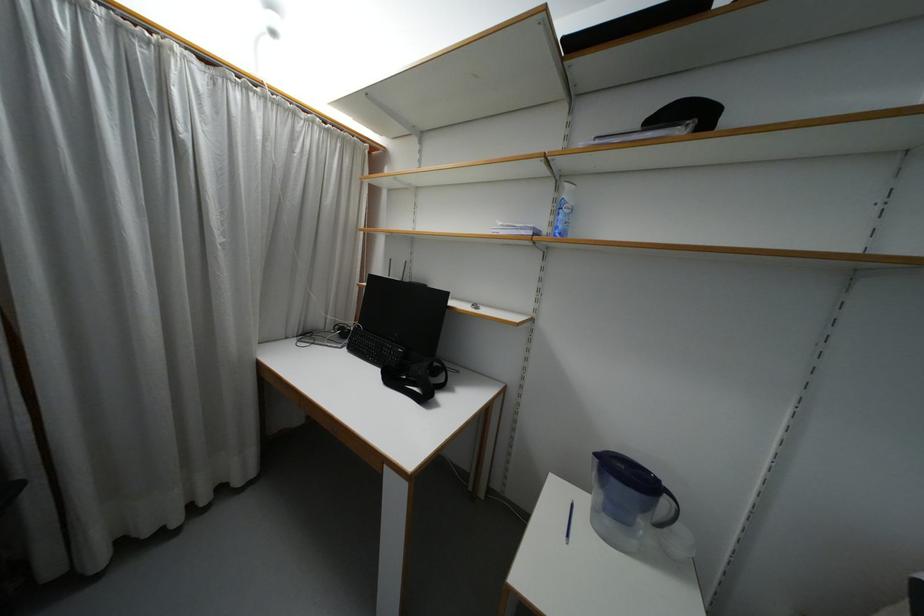
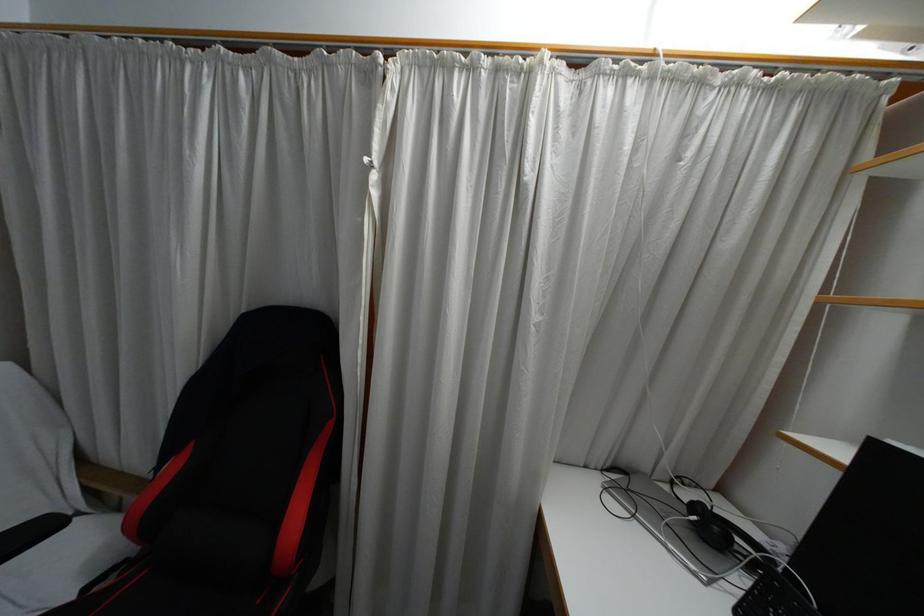
Question: Based on the continuous images, in which direction is the camera rotating? Reply with the corresponding letter.

Choices:
 (A) Left
 (B) Right
 (C) Up
 (D) Down

Answer: (A)